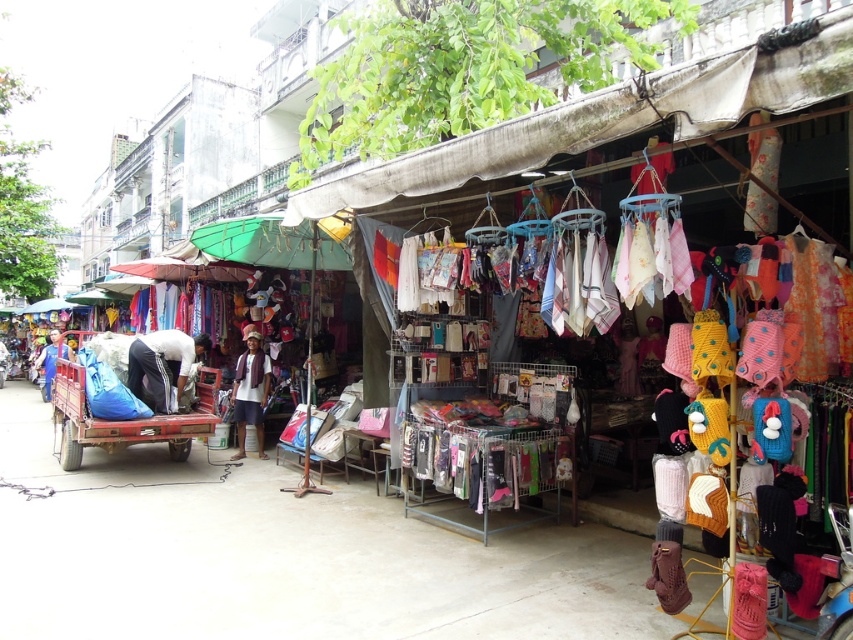
Who is lower down, matte red cart at lower left or white cotton shirt at center?

matte red cart at lower left is lower down.

Does matte red cart at lower left have a larger size compared to white cotton shirt at center?

Yes, matte red cart at lower left is bigger than white cotton shirt at center.

Locate an element on the screen. Image resolution: width=853 pixels, height=640 pixels. matte red cart at lower left is located at coordinates (126, 419).

Is point (257, 340) more distant than point (6, 358)?

No, (257, 340) is in front of (6, 358).

Is white cotton shirt at center positioned at the back of white fabric bag at left?

No.

You are a GUI agent. You are given a task and a screenshot of the screen. Output one action in this format:
    pyautogui.click(x=<x>, y=<y>)
    Task: Click on the white cotton shirt at center
    This screenshot has height=640, width=853.
    Given the screenshot: What is the action you would take?
    pyautogui.click(x=250, y=392)

Where is `white cotton shirt at center`? The height and width of the screenshot is (640, 853). white cotton shirt at center is located at coordinates (250, 392).

Can you confirm if matte red cart at lower left is smaller than dark blue pants at left?

No.

What do you see at coordinates (126, 419) in the screenshot?
I see `matte red cart at lower left` at bounding box center [126, 419].

You are a GUI agent. You are given a task and a screenshot of the screen. Output one action in this format:
    pyautogui.click(x=<x>, y=<y>)
    Task: Click on the matte red cart at lower left
    The width and height of the screenshot is (853, 640).
    Given the screenshot: What is the action you would take?
    pyautogui.click(x=126, y=419)